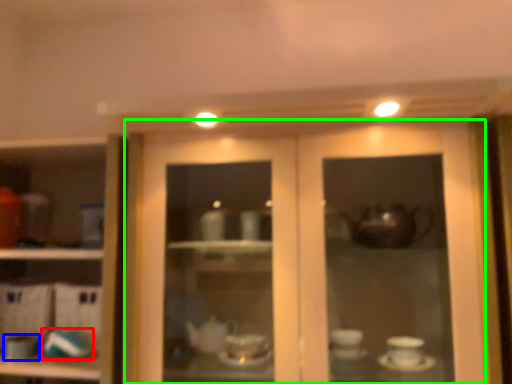
Question: Considering the real-world distances, which object is farthest from tableware (highlighted by a red box)? tableware (highlighted by a blue box) or door (highlighted by a green box)?

Choices:
 (A) tableware
 (B) door

Answer: (B)